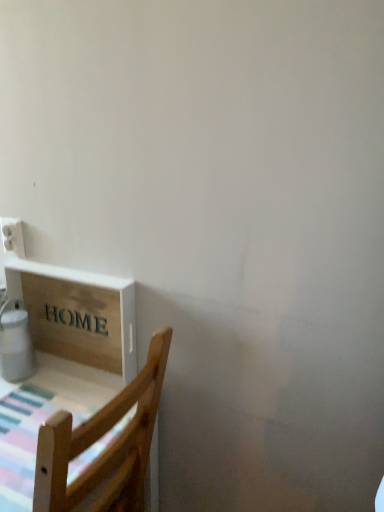
Locate an element on the screen. vacant space underneath wooden sign at lower left (from a real-world perspective) is located at coordinates (77, 367).